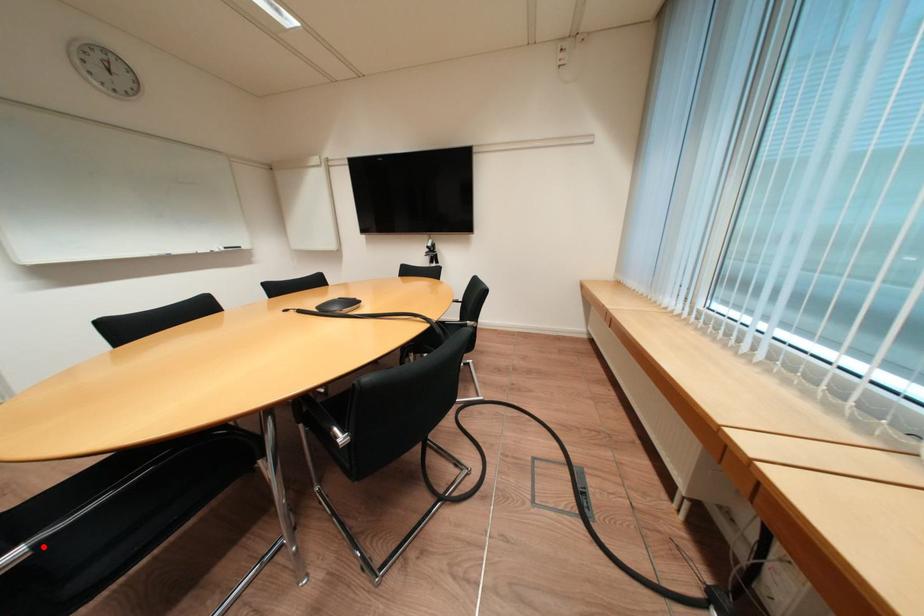
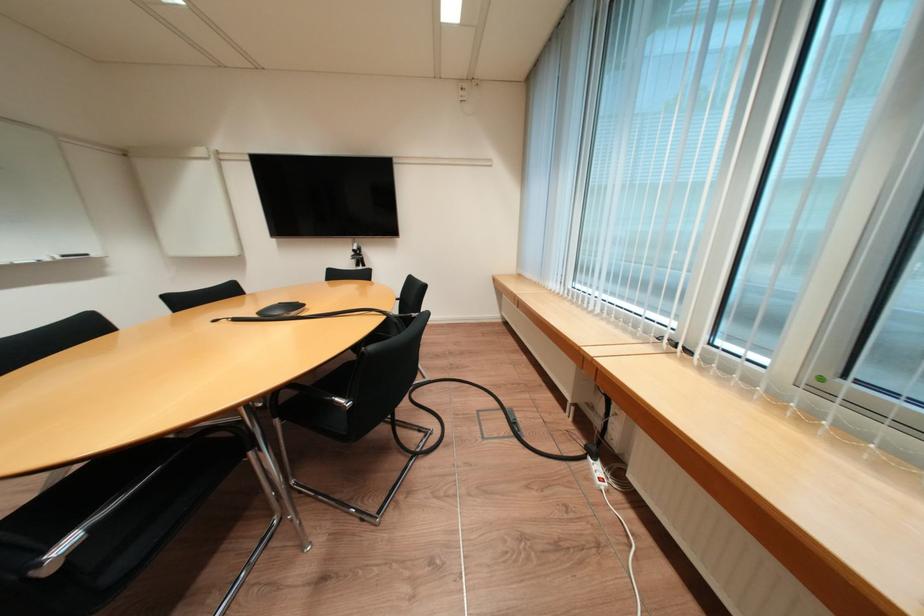
Locate, in the second image, the point that corresponds to the highlighted location in the first image.

(99, 531)